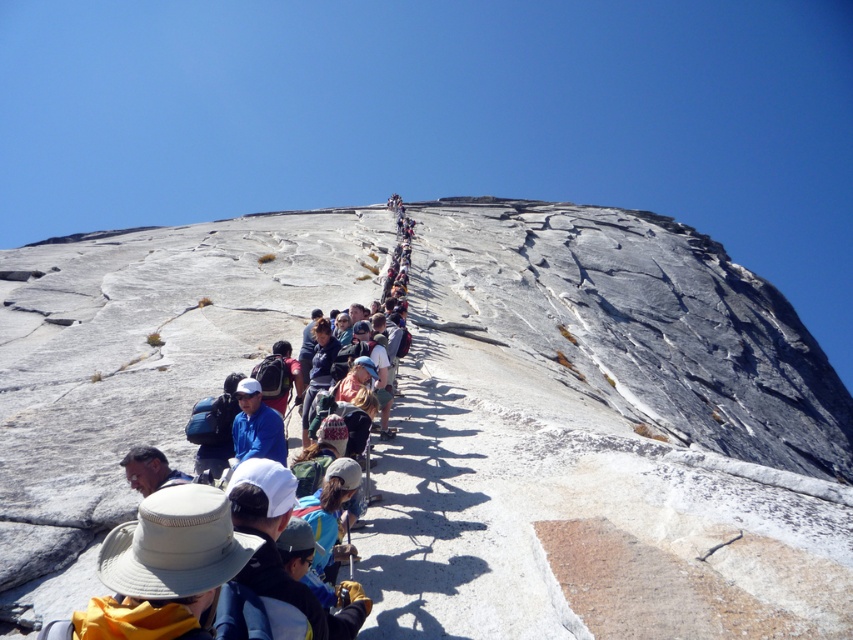
Question: Does gray rock formation at center have a greater width compared to light brown leather hat at center?

Choices:
 (A) no
 (B) yes

Answer: (B)

Question: Does gray rock formation at center appear over light brown leather hat at center?

Choices:
 (A) yes
 (B) no

Answer: (B)

Question: Which object is closer to the camera taking this photo?

Choices:
 (A) light brown leather hat at center
 (B) gray rock formation at center

Answer: (B)

Question: Can you confirm if gray rock formation at center is smaller than light brown leather hat at center?

Choices:
 (A) yes
 (B) no

Answer: (B)

Question: Which point appears farthest from the camera in this image?

Choices:
 (A) (62, 504)
 (B) (123, 262)

Answer: (B)

Question: Which object is closer to the camera taking this photo?

Choices:
 (A) light brown leather hat at center
 (B) gray rock formation at center

Answer: (B)